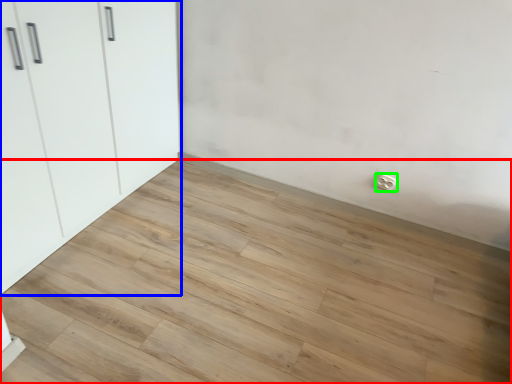
Question: Which object is positioned closest to plank (highlighted by a red box)? Select from cupboard (highlighted by a blue box) and electric outlet (highlighted by a green box).

Choices:
 (A) cupboard
 (B) electric outlet

Answer: (A)